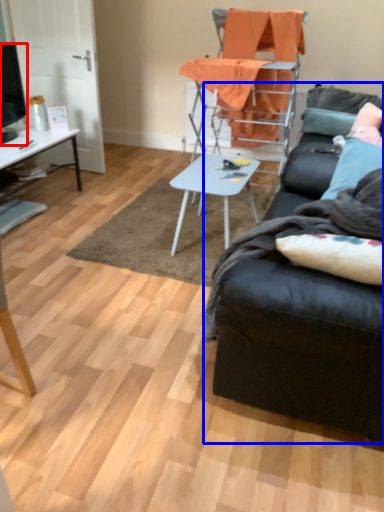
Question: Which object is closer to the camera taking this photo, television (highlighted by a red box) or studio couch (highlighted by a blue box)?

Choices:
 (A) television
 (B) studio couch

Answer: (B)